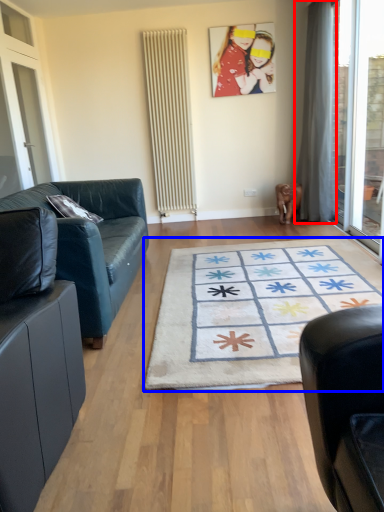
Question: Which point is further to the camera, curtain (highlighted by a red box) or mat (highlighted by a blue box)?

Choices:
 (A) curtain
 (B) mat

Answer: (A)